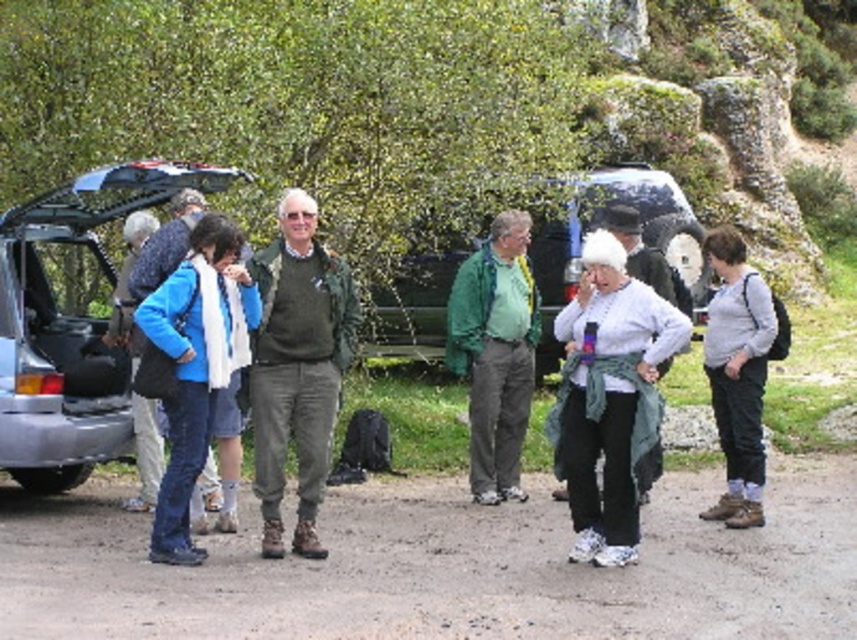
Question: Which of the following is the farthest from the observer?

Choices:
 (A) metallic silver minivan at center
 (B) matte silver car at left

Answer: (A)

Question: Which of the following is the farthest from the observer?

Choices:
 (A) white soft scarf at center
 (B) matte blue jacket at center-left

Answer: (B)

Question: Does matte silver car at left appear over gray cotton shirt at right?

Choices:
 (A) no
 (B) yes

Answer: (B)

Question: Does white soft scarf at center appear over matte blue jacket at center-left?

Choices:
 (A) no
 (B) yes

Answer: (A)

Question: Which point appears farthest from the camera in this image?

Choices:
 (A) (219, 244)
 (B) (717, 248)

Answer: (B)

Question: Can you confirm if white soft scarf at center is wider than green textured jacket at center?

Choices:
 (A) yes
 (B) no

Answer: (A)